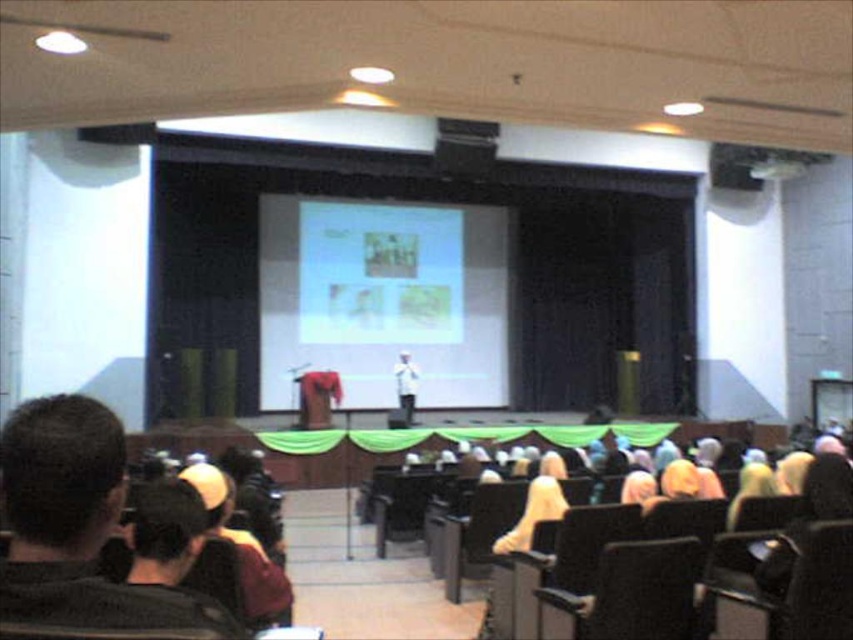
Who is higher up, white glossy screen at center or metallic projector at upper right?

metallic projector at upper right is higher up.

Does white glossy screen at center appear over metallic projector at upper right?

Actually, white glossy screen at center is below metallic projector at upper right.

Identify the location of white glossy screen at center. (383, 300).

The image size is (853, 640). I want to click on dark brown hair at lower left, so click(x=77, y=525).

Can you confirm if dark brown hair at lower left is thinner than metallic projector at upper right?

Correct, dark brown hair at lower left's width is less than metallic projector at upper right's.

Locate an element on the screen. Image resolution: width=853 pixels, height=640 pixels. dark brown hair at lower left is located at coordinates (77, 525).

Is white glossy screen at center closer to the viewer compared to dark brown hair at lower left?

No.

Does point (444, 400) lie in front of point (102, 589)?

No, it is behind (102, 589).

Image resolution: width=853 pixels, height=640 pixels. I want to click on white glossy screen at center, so click(x=383, y=300).